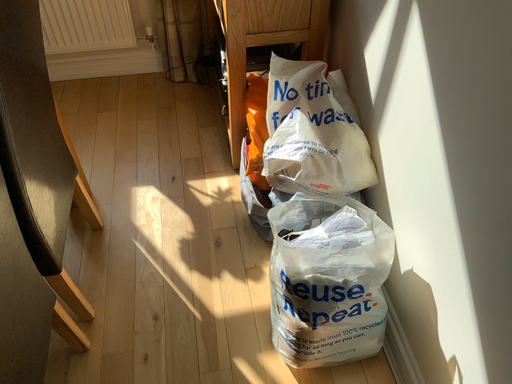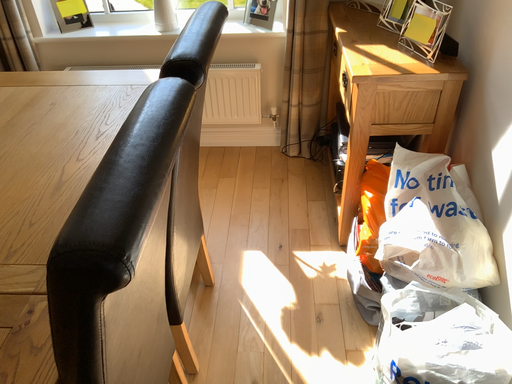
Question: How did the camera likely rotate when shooting the video?

Choices:
 (A) rotated left
 (B) rotated right

Answer: (A)